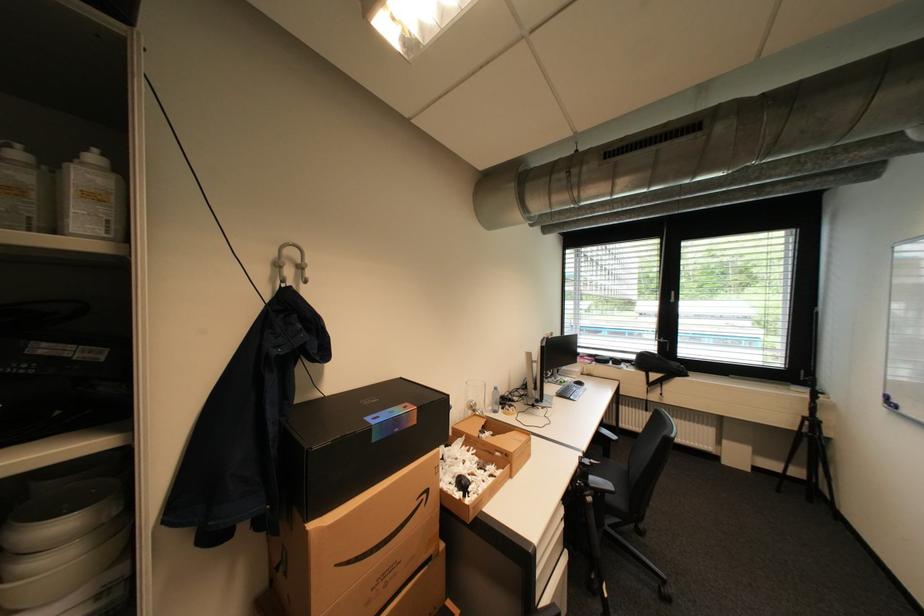
Locate an element on the screen. The height and width of the screenshot is (616, 924). chair sitting surface is located at coordinates (675, 467).